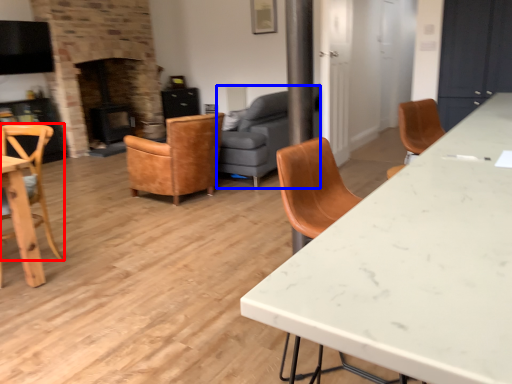
Question: Among these objects, which one is nearest to the camera, chair (highlighted by a red box) or studio couch (highlighted by a blue box)?

Choices:
 (A) chair
 (B) studio couch

Answer: (A)